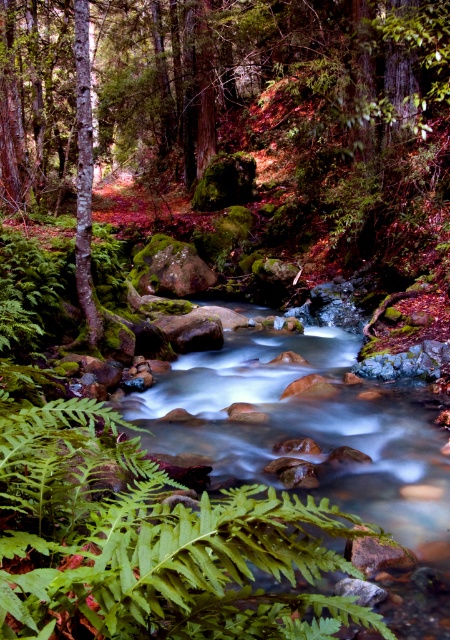
Question: Which point is closer to the camera taking this photo?

Choices:
 (A) (104, 109)
 (B) (82, 74)

Answer: (B)

Question: Estimate the real-world distances between objects in this image. Which object is closer to the smooth bark tree at left?

Choices:
 (A) green mossy rock at center
 (B) green leafy fern at lower left

Answer: (B)

Question: Is green mossy rock at center bigger than green leafy fern at lower left?

Choices:
 (A) yes
 (B) no

Answer: (A)

Question: Is the position of green mossy rock at center more distant than that of green leafy fern at lower left?

Choices:
 (A) no
 (B) yes

Answer: (B)

Question: Does green mossy rock at center lie in front of smooth bark tree at left?

Choices:
 (A) no
 (B) yes

Answer: (A)

Question: Considering the real-world distances, which object is farthest from the smooth bark tree at left?

Choices:
 (A) green leafy fern at lower left
 (B) green mossy rock at center

Answer: (B)